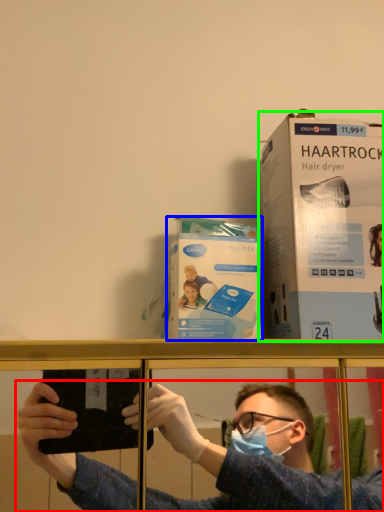
Question: Which is nearer to the person (highlighted by a red box)? paperback book (highlighted by a blue box) or paperback book (highlighted by a green box).

Choices:
 (A) paperback book
 (B) paperback book

Answer: (B)